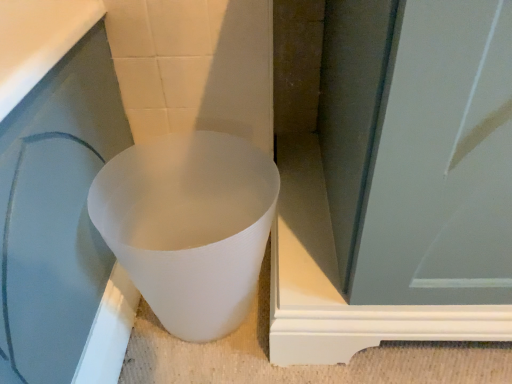
Question: In the image, is white matte plastic cup at lower left positioned in front of or behind white matte screen door at center?

Choices:
 (A) front
 (B) behind

Answer: (B)

Question: Is white matte plastic cup at lower left taller or shorter than white matte screen door at center?

Choices:
 (A) short
 (B) tall

Answer: (A)

Question: Choose the correct answer: Is white matte plastic cup at lower left inside white matte screen door at center or outside it?

Choices:
 (A) inside
 (B) outside

Answer: (B)

Question: In terms of width, does white matte screen door at center look wider or thinner when compared to white matte plastic cup at lower left?

Choices:
 (A) wide
 (B) thin

Answer: (A)

Question: From the image's perspective, is white matte screen door at center located above or below white matte plastic cup at lower left?

Choices:
 (A) below
 (B) above

Answer: (B)

Question: In terms of height, does white matte screen door at center look taller or shorter compared to white matte plastic cup at lower left?

Choices:
 (A) tall
 (B) short

Answer: (A)

Question: Considering the positions of point (411, 266) and point (155, 215), is point (411, 266) closer or farther from the camera than point (155, 215)?

Choices:
 (A) closer
 (B) farther

Answer: (A)